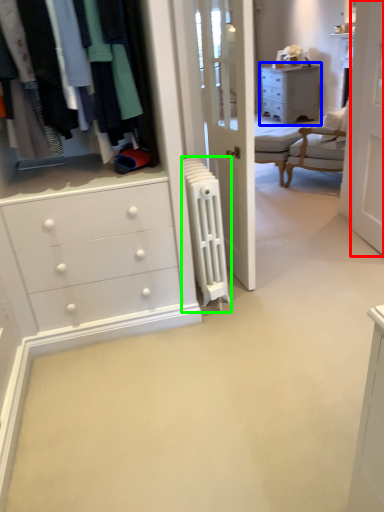
Question: Based on their relative distances, which object is nearer to screen door (highlighted by a red box)? Choose from chest of drawers (highlighted by a blue box) and radiator (highlighted by a green box).

Choices:
 (A) chest of drawers
 (B) radiator

Answer: (B)